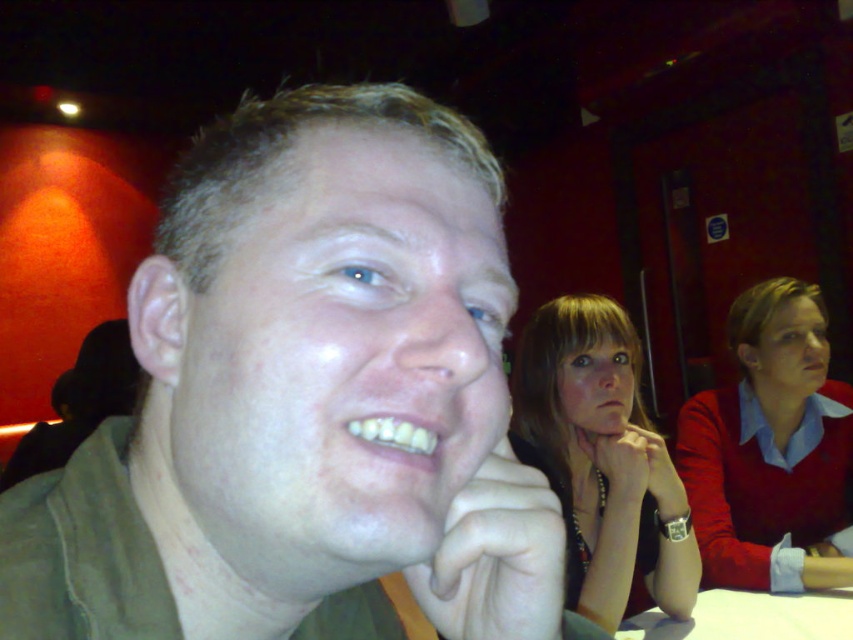
Question: Considering the relative positions of yellowish matte teeth at lower center and white matte mouth at center in the image provided, where is yellowish matte teeth at lower center located with respect to white matte mouth at center?

Choices:
 (A) above
 (B) below

Answer: (A)

Question: Estimate the real-world distances between objects in this image. Which object is closer to the matte red sweater at right?

Choices:
 (A) white matte mouth at center
 (B) yellowish matte teeth at lower center

Answer: (A)

Question: Does matte red sweater at right appear under white matte hand at lower center?

Choices:
 (A) no
 (B) yes

Answer: (B)

Question: Which of the following is the closest to the observer?

Choices:
 (A) yellowish matte teeth at lower center
 (B) matte skin at mouth center
 (C) matte black necklace at center
 (D) white matte hand at lower center

Answer: (A)

Question: Which point is farther from the camera taking this photo?

Choices:
 (A) (386, 467)
 (B) (703, 513)
 (C) (590, 356)
 (D) (404, 451)

Answer: (B)

Question: Is white matte hand at lower center closer to camera compared to matte skin at mouth center?

Choices:
 (A) no
 (B) yes

Answer: (B)